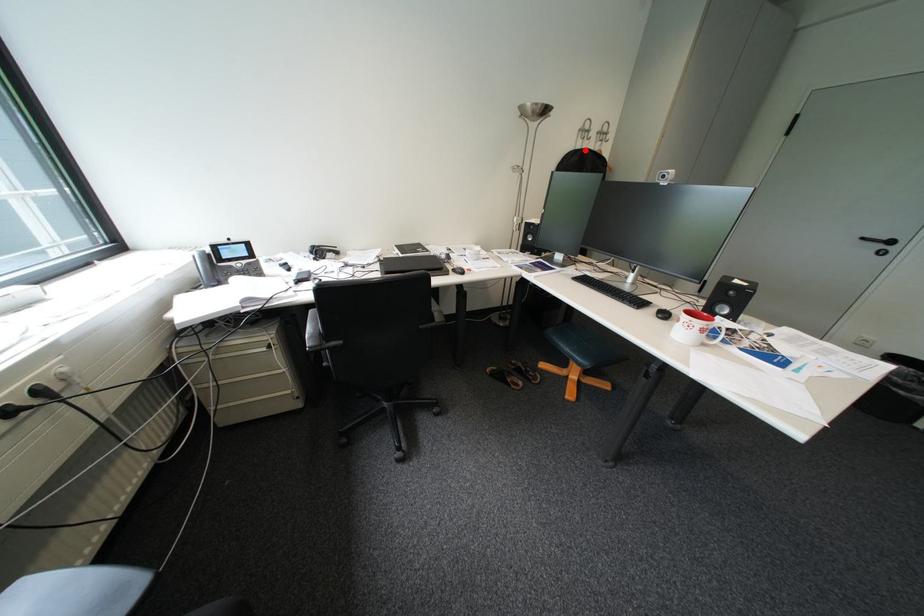
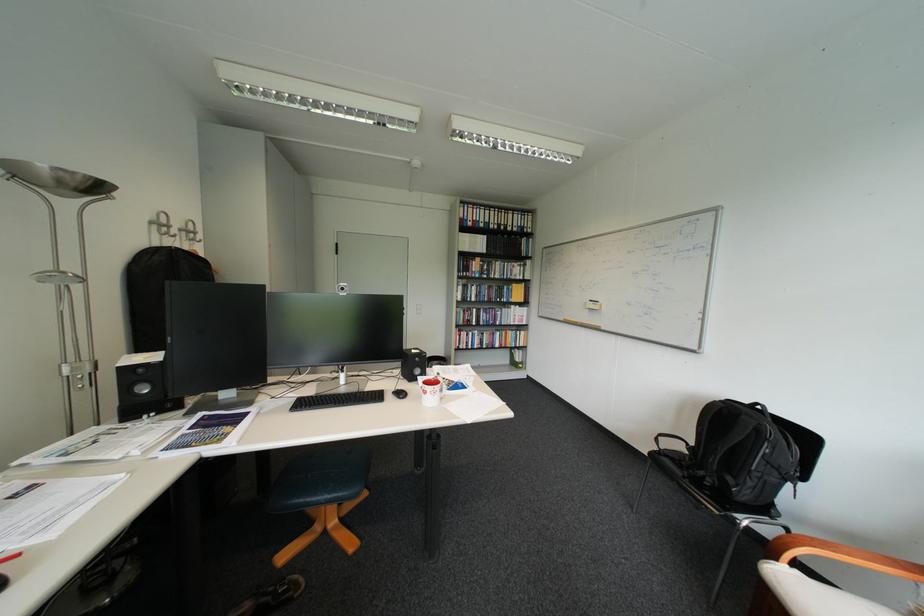
Question: I am providing you with two images of the same scene from different viewpoints. Given a red point in image1, look at the same physical point in image2. Is it:

Choices:
 (A) Closer to the viewpoint
 (B) Farther from the viewpoint

Answer: (B)